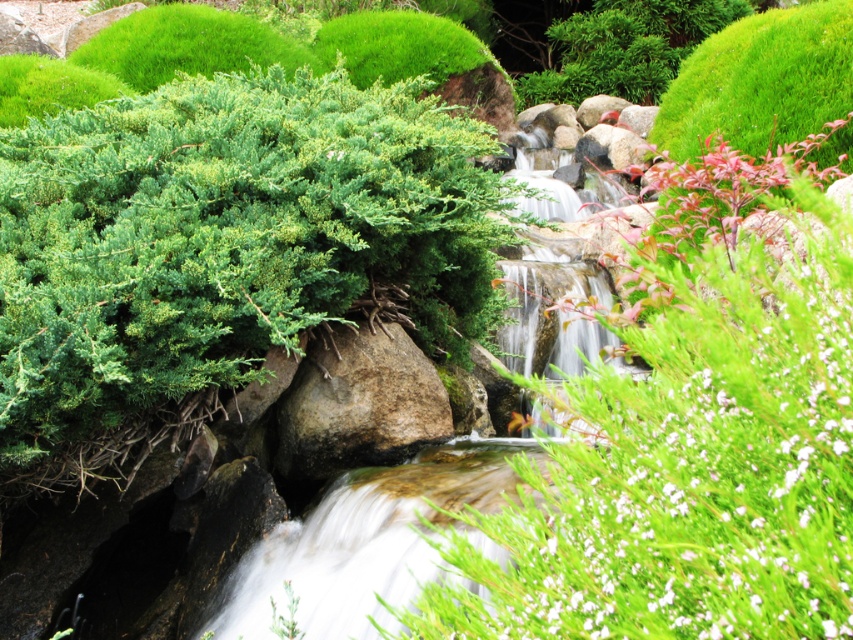
Question: Which point is closer to the camera?

Choices:
 (A) green fuzzy bush at upper center
 (B) brown rough rock at center
 (C) green leafy bush at left

Answer: (C)

Question: Which object is positioned closest to the green fuzzy bush at upper center?

Choices:
 (A) green fuzzy bush at center
 (B) brown rough rock at center

Answer: (A)

Question: Where is green fuzzy bush at center located in relation to brown rough rock at center in the image?

Choices:
 (A) below
 (B) above

Answer: (B)

Question: Estimate the real-world distances between objects in this image. Which object is closer to the green fuzzy bush at center?

Choices:
 (A) brown rough rock at center
 (B) green fuzzy bush at upper center

Answer: (A)

Question: Considering the relative positions of green fuzzy bush at center and green fuzzy bush at upper center in the image provided, where is green fuzzy bush at center located with respect to green fuzzy bush at upper center?

Choices:
 (A) right
 (B) left

Answer: (B)

Question: Is green fuzzy bush at center to the left of brown rough rock at center from the viewer's perspective?

Choices:
 (A) yes
 (B) no

Answer: (B)